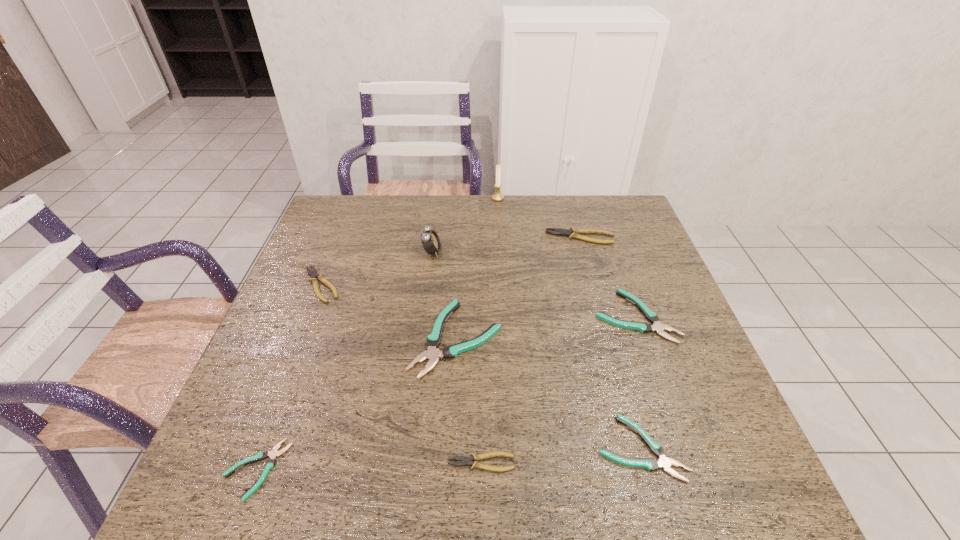
What are the coordinates of `yellow pliers object that ranks as the second closest to the biggest teal pliers` in the screenshot? It's located at (314, 275).

Where is `the closest yellow pliers to the third smallest teal pliers`? the closest yellow pliers to the third smallest teal pliers is located at coordinates (572, 233).

The width and height of the screenshot is (960, 540). Find the location of `teal pliers that stands as the second closest to the shortest object`. teal pliers that stands as the second closest to the shortest object is located at coordinates (650, 464).

Where is `teal pliers identified as the closest to the tallest object`? Image resolution: width=960 pixels, height=540 pixels. teal pliers identified as the closest to the tallest object is located at coordinates (432, 354).

Find the location of a particular element. free space that satisfies the following two spatial constraints: 1. on the back side of the second biggest teal pliers; 2. on the left side of the third teal pliers from right to left is located at coordinates (457, 316).

The image size is (960, 540). I want to click on free space that satisfies the following two spatial constraints: 1. on the face of the alarm clock; 2. on the back side of the second biggest teal pliers, so click(423, 316).

The height and width of the screenshot is (540, 960). In order to click on free location that satisfies the following two spatial constraints: 1. on the front side of the farthest pliers; 2. on the face of the white alarm clock in this screenshot , I will do `click(585, 252)`.